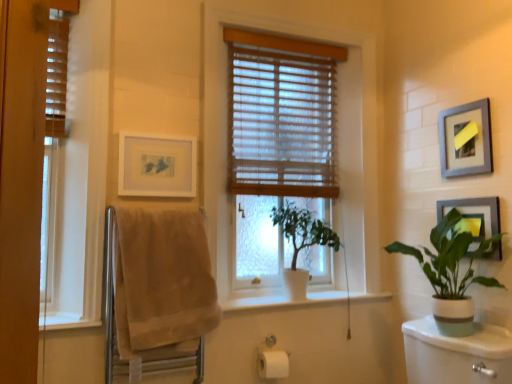
Describe the element at coordinates (465, 139) in the screenshot. I see `metallic silver picture frame at upper right, marked as the 2th picture frame in a left-to-right arrangement` at that location.

Consider the image. What is the approximate height of beige cotton towel at left?

24.57 inches.

Where is `matte gray picture frame at right, the 3th picture frame viewed from the left`? matte gray picture frame at right, the 3th picture frame viewed from the left is located at coordinates click(474, 217).

This screenshot has height=384, width=512. Identify the location of wooden blinds at left, which is the first window in front-to-back order. (78, 179).

Considering the sizes of objects white matte plant at center, the 2th houseplant viewed from the right, and metallic silver picture frame at upper right, the 2th picture frame from the right, in the image provided, who is wider, white matte plant at center, the 2th houseplant viewed from the right, or metallic silver picture frame at upper right, the 2th picture frame from the right,?

white matte plant at center, the 2th houseplant viewed from the right.

Is metallic silver picture frame at upper right, marked as the 2th picture frame in a left-to-right arrangement, located within white matte plant at center, the 2th houseplant viewed from the right?

No, metallic silver picture frame at upper right, marked as the 2th picture frame in a left-to-right arrangement, is located outside of white matte plant at center, the 2th houseplant viewed from the right.

Is white matte plant at center, which is counted as the first houseplant, starting from the left, behind metallic silver picture frame at upper right, the 2th picture frame from the right?

Yes, the depth of white matte plant at center, which is counted as the first houseplant, starting from the left, is greater than that of metallic silver picture frame at upper right, the 2th picture frame from the right.

Could you tell me if white matte plant at center, the 2th houseplant viewed from the right, is facing metallic silver picture frame at upper right, marked as the 2th picture frame in a left-to-right arrangement?

No.

Can you confirm if wooden blinds at left, acting as the 2th window starting from the back, is positioned to the left of wooden blinds at center?

Correct, you'll find wooden blinds at left, acting as the 2th window starting from the back, to the left of wooden blinds at center.

Does wooden blinds at left, which is the first window in front-to-back order, have a lesser height compared to wooden blinds at center?

Incorrect, the height of wooden blinds at left, which is the first window in front-to-back order, does not fall short of that of wooden blinds at center.

What's the angular difference between wooden blinds at left, acting as the 2th window starting from the back, and wooden blinds at center's facing directions?

They differ by 0.123 degrees in their facing directions.

From the image's perspective, does wooden blinds at left, acting as the 2th window starting from the back, appear lower than wooden blinds at center?

Yes, from the image's perspective, wooden blinds at left, acting as the 2th window starting from the back, is beneath wooden blinds at center.

Is matte gray picture frame at right, the 3th picture frame viewed from the left, to the left or to the right of white matte picture frame at upper left, which ranks as the 3th picture frame in right-to-left order, in the image?

Based on their positions, matte gray picture frame at right, the 3th picture frame viewed from the left, is located to the right of white matte picture frame at upper left, which ranks as the 3th picture frame in right-to-left order.

From the picture: From the image's perspective, is matte gray picture frame at right, the first picture frame in the right-to-left sequence, above white matte picture frame at upper left, which ranks as the 3th picture frame in right-to-left order?

No.

From a real-world perspective, is matte gray picture frame at right, the 3th picture frame viewed from the left, physically above white matte picture frame at upper left, acting as the first picture frame starting from the left?

Actually, matte gray picture frame at right, the 3th picture frame viewed from the left, is physically below white matte picture frame at upper left, acting as the first picture frame starting from the left, in the real world.

From the image's perspective, which one is positioned higher, white matte picture frame at upper left, which ranks as the 3th picture frame in right-to-left order, or matte gray picture frame at right, the first picture frame in the right-to-left sequence?

From the image's view, white matte picture frame at upper left, which ranks as the 3th picture frame in right-to-left order, is above.

Which picture frame is the 2nd one when counting from the back of the matte gray picture frame at right, the 3th picture frame viewed from the left? Please provide its 2D coordinates.

[(157, 165)]

Considering the positions of point (137, 136) and point (490, 251), is point (137, 136) closer or farther from the camera than point (490, 251)?

Point (137, 136).

From the picture: Between white matte picture frame at upper left, which ranks as the 3th picture frame in right-to-left order, and wooden blinds at center, which one has less height?

white matte picture frame at upper left, which ranks as the 3th picture frame in right-to-left order.

Is the position of white matte picture frame at upper left, acting as the first picture frame starting from the left, less distant than that of wooden blinds at center?

Yes, white matte picture frame at upper left, acting as the first picture frame starting from the left, is closer to the viewer.

Does white matte picture frame at upper left, which ranks as the 3th picture frame in right-to-left order, appear on the left side of wooden blinds at center?

Yes, white matte picture frame at upper left, which ranks as the 3th picture frame in right-to-left order, is to the left of wooden blinds at center.

Does point (161, 137) come in front of point (237, 90)?

Yes, it is in front of point (237, 90).

Is white ceramic plant at right, the first houseplant viewed from the right, looking in the opposite direction of wooden blinds at center, which is the 1th window from back to front?

No.

From a real-world perspective, relative to wooden blinds at center, positioned as the 1th window in right-to-left order, is white ceramic plant at right, the first houseplant viewed from the right, vertically above or below?

white ceramic plant at right, the first houseplant viewed from the right, is situated lower than wooden blinds at center, positioned as the 1th window in right-to-left order, in the real world.

Is point (447, 326) farther from camera compared to point (316, 36)?

No, (447, 326) is in front of (316, 36).

Does beige cotton towel at left lie in front of wooden blinds at left, which is the first window in front-to-back order?

Yes.

Locate an element on the screen. The width and height of the screenshot is (512, 384). bath towel directly beneath the wooden blinds at left, acting as the 2th window starting from the back (from a real-world perspective) is located at coordinates (162, 281).

From the image's perspective, between beige cotton towel at left and wooden blinds at left, placed as the 2th window when sorted from right to left, which one is located above?

wooden blinds at left, placed as the 2th window when sorted from right to left, appears higher in the image.

Is point (135, 343) positioned before point (41, 311)?

That is True.

From the image's perspective, starting from the white matte plant at center, the 2th houseplant viewed from the right, which picture frame is the 3rd one above? Please provide its 2D coordinates.

[(465, 139)]

From the wooden blinds at center, count 2nd windows forward and point to it. Please provide its 2D coordinates.

[(78, 179)]

Estimate the real-world distances between objects in this image. Which object is further from wooden blinds at center, beige cotton towel at left or wooden blinds at center, positioned as the 1th window in right-to-left order?

The object further to wooden blinds at center is beige cotton towel at left.

Considering their positions, is white matte picture frame at upper left, acting as the first picture frame starting from the left, positioned further to wooden blinds at left, acting as the 1th window starting from the left, than matte gray picture frame at right, the 3th picture frame viewed from the left?

matte gray picture frame at right, the 3th picture frame viewed from the left, is positioned further to the anchor wooden blinds at left, acting as the 1th window starting from the left.

Which object lies further to the anchor point metallic silver picture frame at upper right, the 2th picture frame from the right, white matte plant at center, the 2th houseplant viewed from the right, or wooden blinds at center, the second window when ordered from front to back?

white matte plant at center, the 2th houseplant viewed from the right, lies further to metallic silver picture frame at upper right, the 2th picture frame from the right, than the other object.

From the image, which object appears to be farther from matte gray picture frame at right, the 3th picture frame viewed from the left, wooden blinds at center or metallic silver picture frame at upper right, the 2th picture frame from the right?

wooden blinds at center is positioned further to the anchor matte gray picture frame at right, the 3th picture frame viewed from the left.

Considering their positions, is beige cotton towel at left positioned closer to wooden blinds at left, placed as the 2th window when sorted from right to left, than wooden blinds at center?

beige cotton towel at left is positioned closer to the anchor wooden blinds at left, placed as the 2th window when sorted from right to left.

Estimate the real-world distances between objects in this image. Which object is closer to white matte picture frame at upper left, which ranks as the 3th picture frame in right-to-left order, white ceramic plant at right, the first houseplant viewed from the right, or beige cotton towel at left?

Among the two, beige cotton towel at left is located nearer to white matte picture frame at upper left, which ranks as the 3th picture frame in right-to-left order.

Based on the photo, looking at the image, which one is located closer to metallic silver picture frame at upper right, marked as the 2th picture frame in a left-to-right arrangement, wooden blinds at center or white matte plant at center, which is counted as the first houseplant, starting from the left?

Based on the image, wooden blinds at center appears to be nearer to metallic silver picture frame at upper right, marked as the 2th picture frame in a left-to-right arrangement.

Which object lies further to the anchor point wooden blinds at center, the second window when ordered from front to back, beige cotton towel at left or matte gray picture frame at right, the 3th picture frame viewed from the left?

The object further to wooden blinds at center, the second window when ordered from front to back, is matte gray picture frame at right, the 3th picture frame viewed from the left.

Where is `bath towel between white matte picture frame at upper left, acting as the first picture frame starting from the left, and white matte plant at center, the 2th houseplant viewed from the right, from left to right`? This screenshot has width=512, height=384. bath towel between white matte picture frame at upper left, acting as the first picture frame starting from the left, and white matte plant at center, the 2th houseplant viewed from the right, from left to right is located at coordinates (162, 281).

Identify the location of bath towel between wooden blinds at left, acting as the 2th window starting from the back, and white matte plant at center, which is counted as the first houseplant, starting from the left, in the horizontal direction. The height and width of the screenshot is (384, 512). (162, 281).

Where is `window located between wooden blinds at left, acting as the 2th window starting from the back, and white matte plant at center, the 2th houseplant viewed from the right, in the left-right direction`? window located between wooden blinds at left, acting as the 2th window starting from the back, and white matte plant at center, the 2th houseplant viewed from the right, in the left-right direction is located at coordinates (337, 149).

You are a GUI agent. You are given a task and a screenshot of the screen. Output one action in this format:
    pyautogui.click(x=<x>, y=<y>)
    Task: Click on the bath towel between wooden blinds at left, acting as the 2th window starting from the back, and matte gray picture frame at right, the 3th picture frame viewed from the left, in the horizontal direction
    The image size is (512, 384).
    Given the screenshot: What is the action you would take?
    pyautogui.click(x=162, y=281)